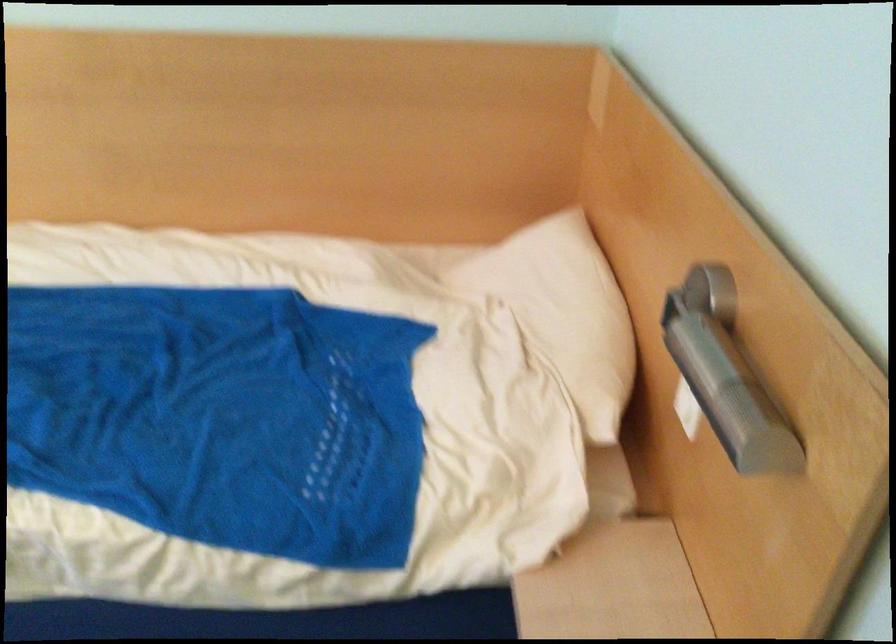
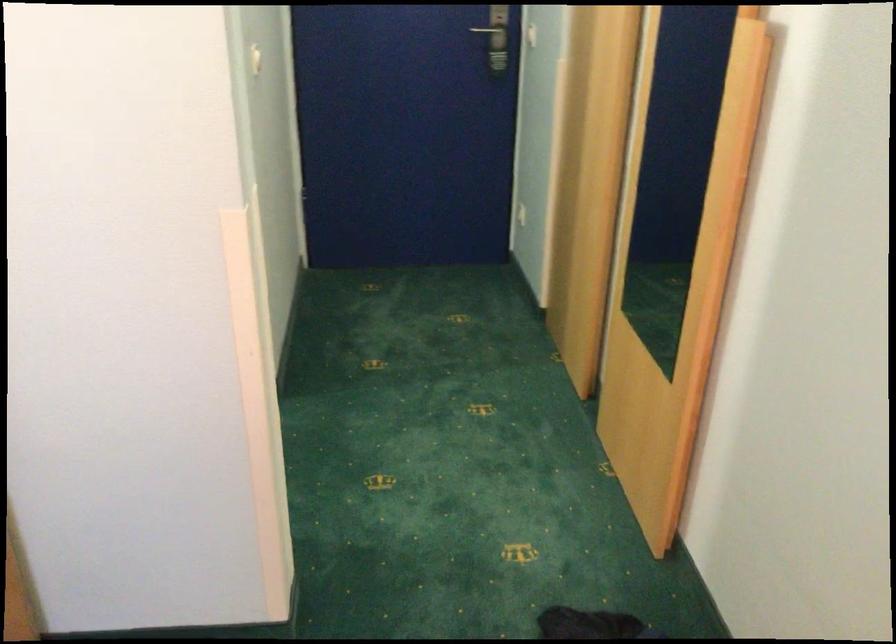
Consider the image. How did the camera likely rotate?

The rotation direction of the camera is right-down.